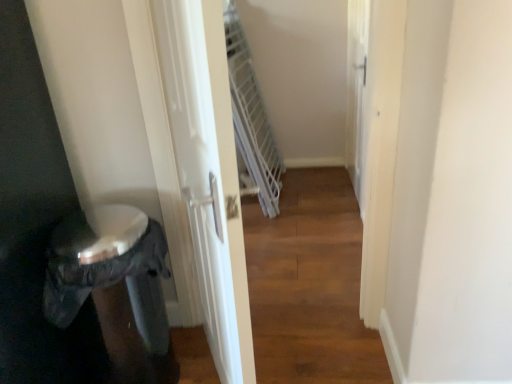
Question: Is white glossy screen door at center, the 2th screen door viewed from the right, behind black plastic potty at lower left?

Choices:
 (A) yes
 (B) no

Answer: (B)

Question: From a real-world perspective, does white glossy screen door at center, the second screen door in the back-to-front sequence, sit lower than black plastic potty at lower left?

Choices:
 (A) no
 (B) yes

Answer: (A)

Question: Does white glossy screen door at center, the 1th screen door from the left, have a larger size compared to black plastic potty at lower left?

Choices:
 (A) yes
 (B) no

Answer: (B)

Question: Considering the relative positions of white glossy screen door at center, the 1th screen door from the left, and black plastic potty at lower left in the image provided, is white glossy screen door at center, the 1th screen door from the left, to the right of black plastic potty at lower left from the viewer's perspective?

Choices:
 (A) yes
 (B) no

Answer: (A)

Question: Can you confirm if white glossy screen door at center, the 2th screen door viewed from the right, is taller than black plastic potty at lower left?

Choices:
 (A) no
 (B) yes

Answer: (B)

Question: From a real-world perspective, is white glossy screen door at center, the second screen door in the back-to-front sequence, positioned over black plastic potty at lower left based on gravity?

Choices:
 (A) yes
 (B) no

Answer: (A)

Question: Would you say white glossy screen door at center, the 1th screen door from the left, is part of black plastic potty at lower left's contents?

Choices:
 (A) no
 (B) yes

Answer: (A)

Question: Does black plastic potty at lower left have a larger size compared to white glossy screen door at center, the 2th screen door viewed from the right?

Choices:
 (A) yes
 (B) no

Answer: (A)

Question: Is black plastic potty at lower left smaller than white glossy screen door at center, the second screen door in the back-to-front sequence?

Choices:
 (A) yes
 (B) no

Answer: (B)

Question: From a real-world perspective, does black plastic potty at lower left stand above white glossy screen door at center, which appears as the first screen door when viewed from the front?

Choices:
 (A) yes
 (B) no

Answer: (B)

Question: Considering the relative positions of black plastic potty at lower left and white glossy screen door at center, the 1th screen door from the left, in the image provided, is black plastic potty at lower left behind white glossy screen door at center, the 1th screen door from the left,?

Choices:
 (A) yes
 (B) no

Answer: (A)

Question: Considering the relative sizes of black plastic potty at lower left and white glossy screen door at center, the 2th screen door viewed from the right, in the image provided, is black plastic potty at lower left shorter than white glossy screen door at center, the 2th screen door viewed from the right,?

Choices:
 (A) no
 (B) yes

Answer: (B)

Question: From the image's perspective, would you say white glossy screen door at upper right, the 1th screen door viewed from the back, is shown under white glossy screen door at center, which appears as the first screen door when viewed from the front?

Choices:
 (A) yes
 (B) no

Answer: (B)